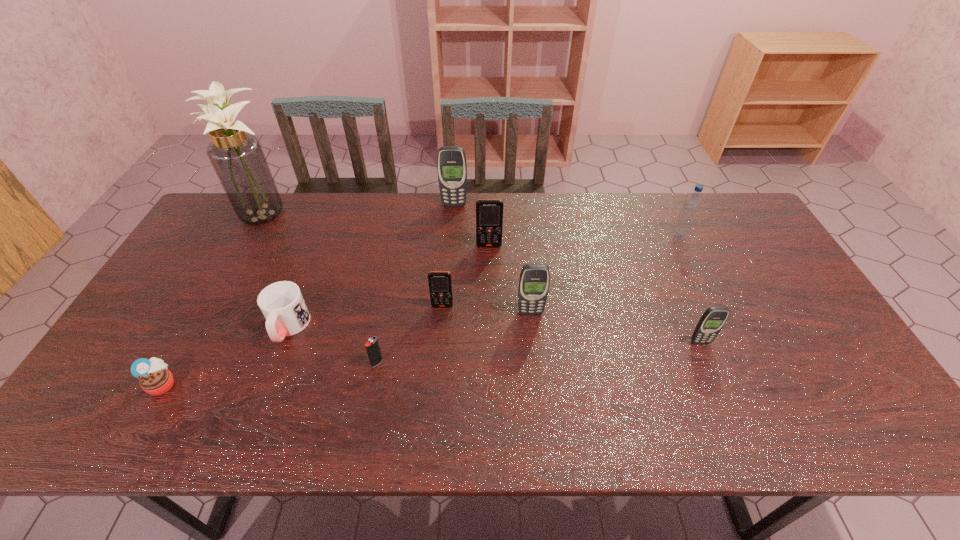
At what (x,y) coordinates should I click in order to perform the action: click on vacant area that lies between the third farthest cellular telephone and the fourth object from left to right. Please return your answer as a coordinate pair (x, y). This screenshot has width=960, height=540. Looking at the image, I should click on point(410,334).

Find the location of a particular element. The height and width of the screenshot is (540, 960). empty location between the nearest object and the farthest gray cellular telephone is located at coordinates (308, 295).

The image size is (960, 540). In order to click on free space between the fourth object from left to right and the flower arrangement in this screenshot , I will do `click(321, 288)`.

Identify the location of vacant area that lies between the third object from left to right and the second smallest gray cellular telephone. The height and width of the screenshot is (540, 960). (409, 320).

Locate an element on the screen. The height and width of the screenshot is (540, 960). free space between the bigger orange cellular telephone and the left orange cellular telephone is located at coordinates (466, 276).

The width and height of the screenshot is (960, 540). Find the location of `blank region between the smaller orange cellular telephone and the fourth object from left to right`. blank region between the smaller orange cellular telephone and the fourth object from left to right is located at coordinates (410, 334).

What are the coordinates of `vacant point located between the third farthest cellular telephone and the pink muffin` in the screenshot? It's located at (302, 345).

I want to click on free spot between the tallest object and the eighth object from left to right, so click(397, 263).

Image resolution: width=960 pixels, height=540 pixels. I want to click on blank region between the farthest cellular telephone and the black igniter, so click(x=416, y=284).

This screenshot has height=540, width=960. I want to click on vacant space that's between the bigger orange cellular telephone and the left orange cellular telephone, so click(x=466, y=276).